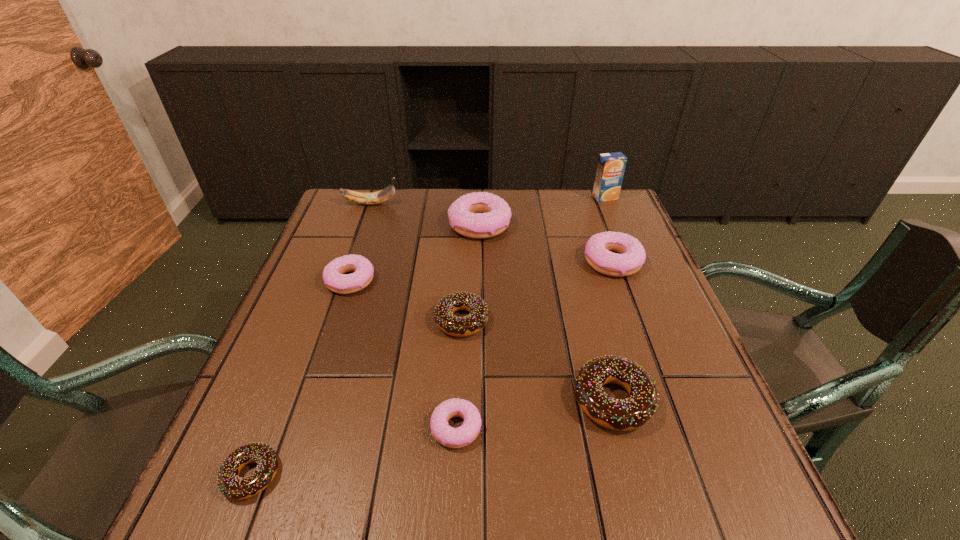
This screenshot has width=960, height=540. Find the location of `object that is at the far left corner`. object that is at the far left corner is located at coordinates (385, 194).

This screenshot has height=540, width=960. Identify the location of object that is at the near left corner. (232, 486).

This screenshot has width=960, height=540. Find the location of `object at the far right corner`. object at the far right corner is located at coordinates (611, 166).

Identify the location of vacant space at the far edge. The width and height of the screenshot is (960, 540). (420, 194).

Find the location of a particular element. vacant space at the near edge of the desktop is located at coordinates (400, 508).

Locate an element on the screen. vacant space at the left edge is located at coordinates (299, 279).

Find the location of `vacant space at the right edge`. vacant space at the right edge is located at coordinates (647, 358).

Where is `vacant region at the far left corner`? This screenshot has width=960, height=540. vacant region at the far left corner is located at coordinates (366, 190).

In the image, there is a desktop. In order to click on blank space at the near left corner in this screenshot , I will do `click(212, 515)`.

Find the location of a particular element. vacant region at the far right corner of the desktop is located at coordinates (622, 195).